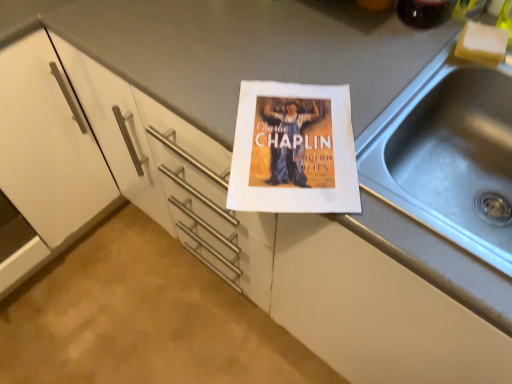
This screenshot has width=512, height=384. What are the coordinates of `vacant space positioned to the left of white sponge at upper right` in the screenshot? It's located at point(395,53).